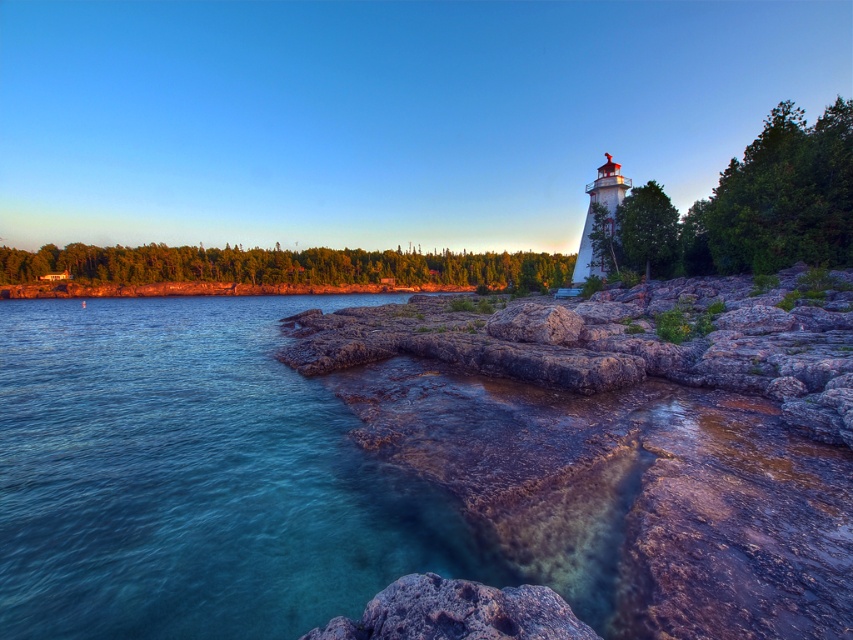
You are a geologist examining the coastal area. You notice two rocks in the scene. The first is the rockysmooth rockrocky at right, and the second is the rusty rock at center. Which of these rocks is taller?

The rockysmooth rockrocky at right is taller than the rusty rock at center.

You are a hiker who wants to cross from the lighthouse to the calm water. You see the clear blue water at lower left and the rusty rock at center. Which object should you avoid stepping on to reach the water safely?

You should avoid stepping on the rusty rock at center because the clear blue water at lower left is positioned under it, meaning the rock is above the water and could be unstable or slippery.

You are a geologist exploring the coastal area and need to collect samples from both the rockysmooth rockrocky at right and the rusty rock at center. If your measuring tape can only extend up to 6 meters, can you reach both rocks without moving the tape?

The distance between the rockysmooth rockrocky at right and the rusty rock at center is 6.12 meters, which exceeds the 6 meter limit of the measuring tape. Therefore, you cannot reach both rocks without moving the tape.